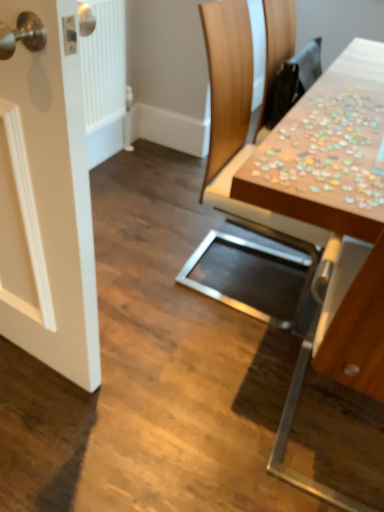
Question: Does wooden puzzle pieces at upper right appear on the left side of wooden chair at upper right?

Choices:
 (A) yes
 (B) no

Answer: (B)

Question: Is wooden puzzle pieces at upper right oriented towards wooden chair at upper right?

Choices:
 (A) no
 (B) yes

Answer: (A)

Question: From a real-world perspective, is wooden puzzle pieces at upper right on wooden chair at upper right?

Choices:
 (A) yes
 (B) no

Answer: (A)

Question: Is wooden puzzle pieces at upper right smaller than wooden chair at upper right?

Choices:
 (A) no
 (B) yes

Answer: (B)

Question: Is wooden puzzle pieces at upper right thinner than wooden chair at upper right?

Choices:
 (A) yes
 (B) no

Answer: (A)

Question: Considering the relative sizes of wooden puzzle pieces at upper right and wooden chair at upper right in the image provided, is wooden puzzle pieces at upper right taller than wooden chair at upper right?

Choices:
 (A) no
 (B) yes

Answer: (A)

Question: Does wooden puzzle pieces at upper right have a lesser height compared to wooden chair at upper right?

Choices:
 (A) no
 (B) yes

Answer: (A)

Question: Is wooden puzzle pieces at upper right not near wooden chair at upper right?

Choices:
 (A) no
 (B) yes

Answer: (A)

Question: From the image's perspective, does wooden puzzle pieces at upper right appear lower than wooden chair at upper right?

Choices:
 (A) yes
 (B) no

Answer: (A)

Question: Is wooden puzzle pieces at upper right closer to camera compared to wooden chair at upper right?

Choices:
 (A) no
 (B) yes

Answer: (B)

Question: Considering the relative sizes of wooden puzzle pieces at upper right and wooden chair at upper right in the image provided, is wooden puzzle pieces at upper right thinner than wooden chair at upper right?

Choices:
 (A) no
 (B) yes

Answer: (A)

Question: Are wooden puzzle pieces at upper right and wooden chair at upper right making contact?

Choices:
 (A) no
 (B) yes

Answer: (A)

Question: From a real-world perspective, does wooden chair at upper right stand above wooden puzzle pieces at upper right?

Choices:
 (A) yes
 (B) no

Answer: (B)